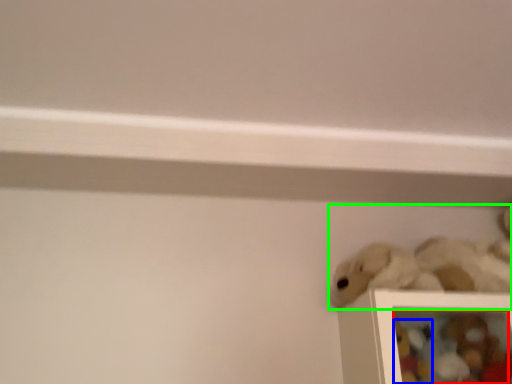
Question: Which object is positioned farthest from toy (highlighted by a red box)? Select from toy (highlighted by a blue box) and toy (highlighted by a green box).

Choices:
 (A) toy
 (B) toy

Answer: (B)